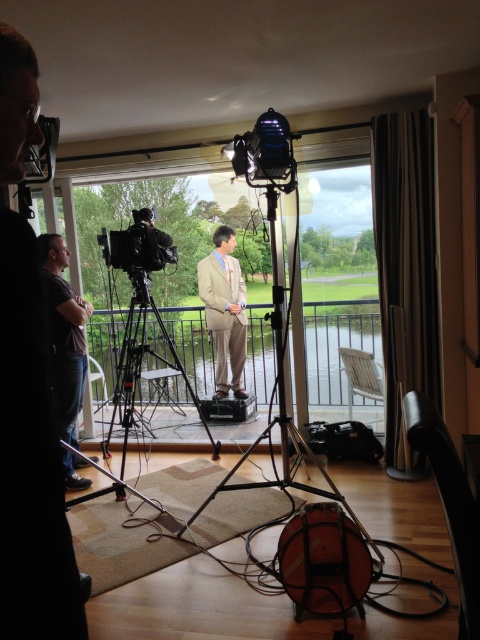
Is black fabric at left above matte black tripod at center?

Correct, black fabric at left is located above matte black tripod at center.

Can you confirm if black fabric at left is bigger than matte black tripod at center?

No, black fabric at left is not bigger than matte black tripod at center.

Between point (3, 269) and point (321, 468), which one is positioned behind?

Point (321, 468)

This screenshot has height=640, width=480. Identify the location of black fabric at left. (31, 458).

Is black fabric at left taller than tan fabric suit at center?

No.

Is point (0, 520) farther from viewer compared to point (229, 275)?

No, (0, 520) is closer to viewer.

Is point (1, 378) positioned in front of point (223, 323)?

Yes, it is.

This screenshot has height=640, width=480. What are the coordinates of `black fabric at left` in the screenshot? It's located at (31, 458).

Which is more to the right, black fabric at left or black plastic video camera at upper center?

black plastic video camera at upper center

Is point (14, 180) positioned after point (276, 157)?

No.

What are the coordinates of `black fabric at left` in the screenshot? It's located at (31, 458).